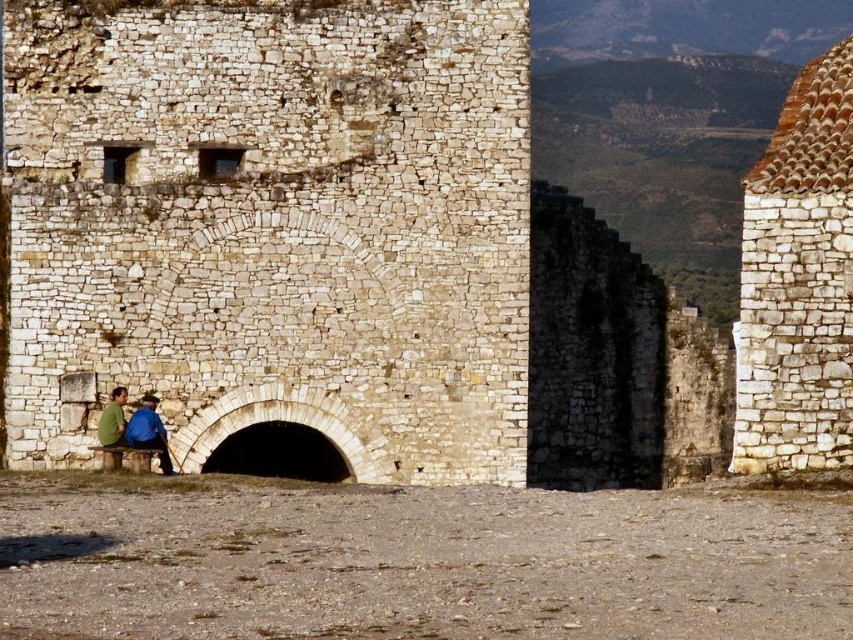
Locate an element on the screen. This screenshot has width=853, height=640. white stone roof at upper right is located at coordinates (798, 280).

Can you confirm if white stone roof at upper right is shorter than blue shirt at lower left?

No, white stone roof at upper right is not shorter than blue shirt at lower left.

Is point (790, 124) farther from camera compared to point (163, 451)?

That is False.

Find the location of `white stone roof at upper right`. white stone roof at upper right is located at coordinates (798, 280).

Between blue shirt at lower left and green matte shirt at lower left, which one appears on the right side from the viewer's perspective?

From the viewer's perspective, blue shirt at lower left appears more on the right side.

Does point (163, 472) lie in front of point (115, 445)?

No, it is behind (115, 445).

Find the location of a particular element. The image size is (853, 640). blue shirt at lower left is located at coordinates (148, 432).

Which is above, white stone roof at upper right or green matte shirt at lower left?

white stone roof at upper right is higher up.

Is white stone roof at upper right behind green matte shirt at lower left?

No, white stone roof at upper right is closer to the viewer.

Which is in front, point (775, 440) or point (115, 435)?

Point (775, 440) is more forward.

Locate an element on the screen. The height and width of the screenshot is (640, 853). white stone roof at upper right is located at coordinates (798, 280).